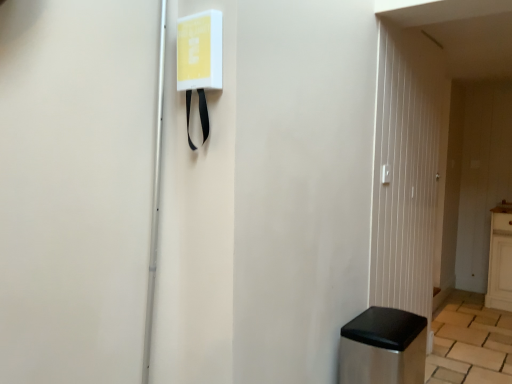
Question: Does transparent glass door at right have a lesser width compared to stainless steel trash can at lower right?

Choices:
 (A) yes
 (B) no

Answer: (A)

Question: Is transparent glass door at right far away from stainless steel trash can at lower right?

Choices:
 (A) no
 (B) yes

Answer: (A)

Question: Does transparent glass door at right turn towards stainless steel trash can at lower right?

Choices:
 (A) no
 (B) yes

Answer: (A)

Question: Is transparent glass door at right bigger than stainless steel trash can at lower right?

Choices:
 (A) no
 (B) yes

Answer: (B)

Question: Does transparent glass door at right have a lesser height compared to stainless steel trash can at lower right?

Choices:
 (A) yes
 (B) no

Answer: (B)

Question: In the image, is white plastic light switch at upper right positioned in front of or behind transparent glass door at right?

Choices:
 (A) behind
 (B) front

Answer: (A)

Question: In the image, is white plastic light switch at upper right on the left side or the right side of transparent glass door at right?

Choices:
 (A) right
 (B) left

Answer: (B)

Question: Is white plastic light switch at upper right taller or shorter than transparent glass door at right?

Choices:
 (A) short
 (B) tall

Answer: (A)

Question: Is point (386, 182) closer or farther from the camera than point (424, 86)?

Choices:
 (A) closer
 (B) farther

Answer: (A)

Question: From the image's perspective, is stainless steel trash can at lower right located above or below transparent glass door at right?

Choices:
 (A) above
 (B) below

Answer: (B)

Question: Is stainless steel trash can at lower right bigger or smaller than transparent glass door at right?

Choices:
 (A) big
 (B) small

Answer: (B)

Question: Considering their positions, is stainless steel trash can at lower right located in front of or behind transparent glass door at right?

Choices:
 (A) behind
 (B) front

Answer: (B)

Question: Considering the positions of point (358, 362) and point (424, 165), is point (358, 362) closer or farther from the camera than point (424, 165)?

Choices:
 (A) closer
 (B) farther

Answer: (A)

Question: From the image's perspective, is white plastic light switch at upper right positioned above or below stainless steel trash can at lower right?

Choices:
 (A) below
 (B) above

Answer: (B)

Question: Choose the correct answer: Is white plastic light switch at upper right inside stainless steel trash can at lower right or outside it?

Choices:
 (A) outside
 (B) inside

Answer: (A)